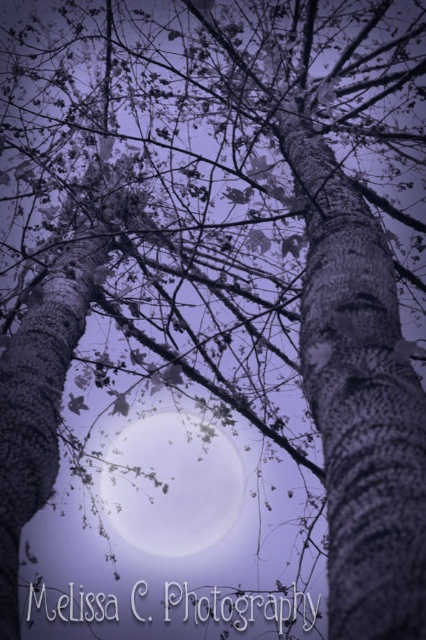
Question: Which object appears farthest from the camera in this image?

Choices:
 (A) translucent glass moon at center
 (B) smooth bark tree trunk at center

Answer: (A)

Question: Does smooth bark tree trunk at center appear on the right side of translucent glass moon at center?

Choices:
 (A) yes
 (B) no

Answer: (A)

Question: Can you confirm if smooth bark tree trunk at center is positioned to the right of translucent glass moon at center?

Choices:
 (A) no
 (B) yes

Answer: (B)

Question: Which point appears farthest from the camera in this image?

Choices:
 (A) (166, 497)
 (B) (419, 532)

Answer: (A)

Question: Does smooth bark tree trunk at center appear under translucent glass moon at center?

Choices:
 (A) yes
 (B) no

Answer: (B)